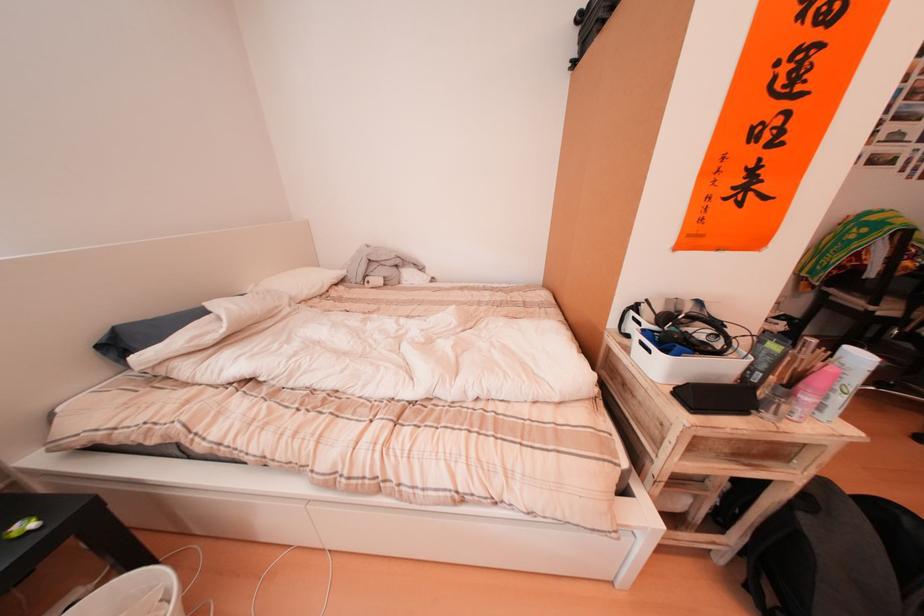
The location [837,556] corresponds to which object?

This point indicates the black backpack.